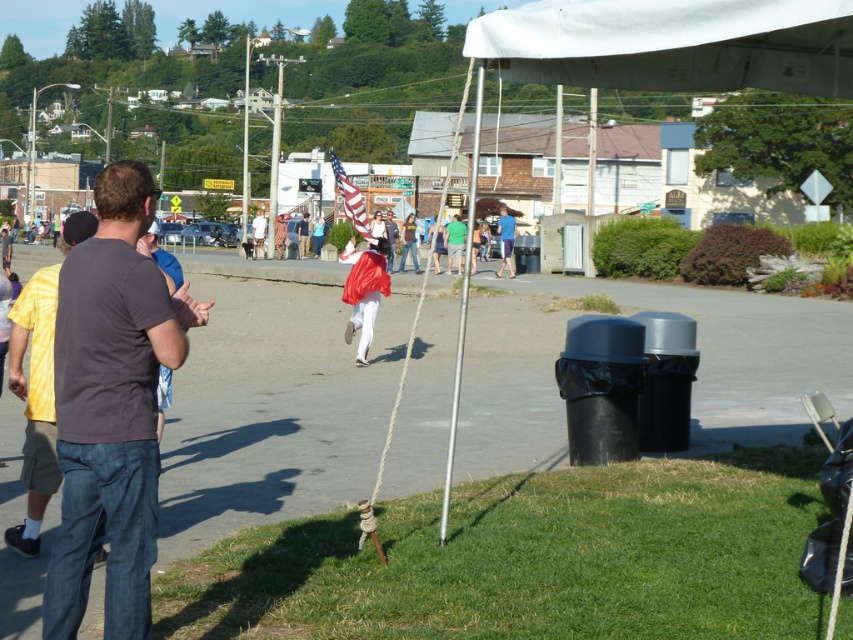
You are standing at point A located at coordinates point A at (503, 248). You want to walk to point B, which is 117.27 feet away from you. Is there enough space to walk directly to point B without any obstacles?

Yes, there is enough space to walk directly to point B from point A at (503, 248) since the distance between them is 117.27 feet and the scene describes an open grassy area with a swing setup and people gathered but no mention of obstacles blocking the path.

You are standing at the point marked by coordinates point (672, 44). Looking around, you see a white fabric canopy at upper center. What object is directly above your head?

The white fabric canopy at upper center is directly above the point (672, 44).

You are standing at the center of the image and want to place a small bench. The blue fabric at center is located at point (505, 241). Where should you place the bench so it is exactly 0.1 units to the right of the blue fabric at center?

The bench should be placed at point 0.477, 0.593, which is 0.1 units to the right of the blue fabric at center located at (505, 241).